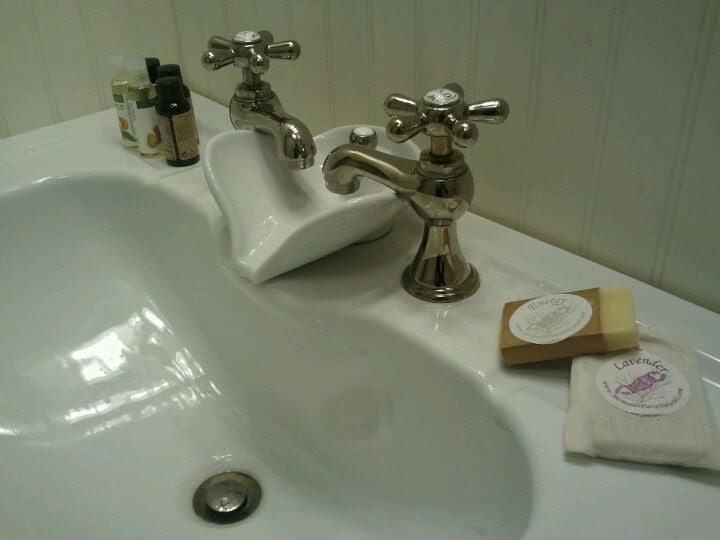
You are a GUI agent. You are given a task and a screenshot of the screen. Output one action in this format:
    pyautogui.click(x=<x>, y=<y>)
    Task: Click on the drain stopper
    The height and width of the screenshot is (540, 720).
    Given the screenshot: What is the action you would take?
    pyautogui.click(x=224, y=492)